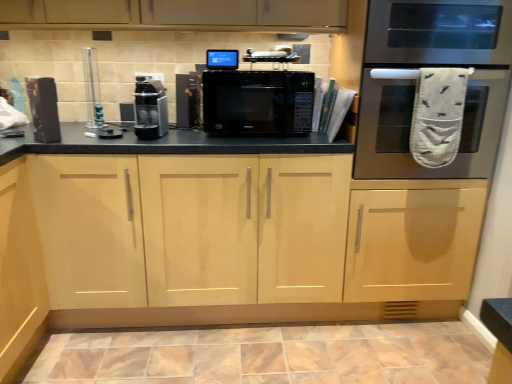
Measure the distance between point (x=412, y=171) and camera.

Result: They are 6.07 feet apart.

Describe the element at coordinates (435, 67) in the screenshot. I see `stainless steel oven at right` at that location.

The height and width of the screenshot is (384, 512). I want to click on light wood cabinet at center, so click(x=263, y=241).

In order to face matte black speaker at left, the fifth appliance when ordered from right to left, should I rotate leftwards or rightwards?

Turn left approximately 26.367 degrees to face it.

Where is `blue glossy monitor at upper center, the first appliance viewed from the right`? Image resolution: width=512 pixels, height=384 pixels. blue glossy monitor at upper center, the first appliance viewed from the right is located at coordinates (222, 59).

Are light wood cabinet at center and marble-like ceramic tile at lower center beside each other?

No, light wood cabinet at center is not in contact with marble-like ceramic tile at lower center.

From the image's perspective, is light wood cabinet at center over marble-like ceramic tile at lower center?

Correct, light wood cabinet at center appears higher than marble-like ceramic tile at lower center in the image.

Could you tell me if light wood cabinet at center is turned towards marble-like ceramic tile at lower center?

Yes, light wood cabinet at center is oriented towards marble-like ceramic tile at lower center.

How far apart are clear glass vase at upper left, which is the second appliance from left to right, and blue glossy monitor at upper center, the first appliance viewed from the right?

They are 24.46 inches apart.

Does clear glass vase at upper left, which is the second appliance from left to right, have a greater height compared to blue glossy monitor at upper center, positioned as the 5th appliance in left-to-right order?

Correct, clear glass vase at upper left, which is the second appliance from left to right, is much taller as blue glossy monitor at upper center, positioned as the 5th appliance in left-to-right order.

Starting from the blue glossy monitor at upper center, positioned as the 5th appliance in left-to-right order, which appliance is the 3rd one to the left? Please provide its 2D coordinates.

[(92, 88)]

From a real-world perspective, is clear glass vase at upper left, which is the second appliance from left to right, positioned above or below blue glossy monitor at upper center, the first appliance viewed from the right?

clear glass vase at upper left, which is the second appliance from left to right, is below blue glossy monitor at upper center, the first appliance viewed from the right.

From a real-world perspective, which object stands above the other?

blue glossy monitor at upper center, the first appliance viewed from the right, from a real-world perspective.

Measure the distance between light wood cabinet at center and blue glossy monitor at upper center, the first appliance viewed from the right.

They are 39.04 inches apart.

Consider the image. Is light wood cabinet at center facing away from blue glossy monitor at upper center, the first appliance viewed from the right?

No, light wood cabinet at center is not facing the opposite direction of blue glossy monitor at upper center, the first appliance viewed from the right.

Between light wood cabinet at center and blue glossy monitor at upper center, positioned as the 5th appliance in left-to-right order, which one appears on the right side from the viewer's perspective?

A: blue glossy monitor at upper center, positioned as the 5th appliance in left-to-right order, is more to the right.

Looking at this image, from their relative heights in the image, would you say stainless steel oven at right is taller or shorter than black matte microwave at center, the second appliance in the right-to-left sequence?

Clearly, stainless steel oven at right is taller compared to black matte microwave at center, the second appliance in the right-to-left sequence.

Is stainless steel oven at right thinner than black matte microwave at center, which is the fourth appliance from left to right?

No.

Which of these two, stainless steel oven at right or black matte microwave at center, which is the fourth appliance from left to right, is bigger?

stainless steel oven at right.

From the image's perspective, is stainless steel oven at right above or below black matte microwave at center, which is the fourth appliance from left to right?

Based on their image positions, stainless steel oven at right is located above black matte microwave at center, which is the fourth appliance from left to right.

The height and width of the screenshot is (384, 512). What are the coordinates of `microwave oven behind the light wood cabinet at center` in the screenshot? It's located at (258, 102).

Measure the distance from black matte microwave at center to light wood cabinet at center.

black matte microwave at center is 17.03 inches away from light wood cabinet at center.

From a real-world perspective, is black matte microwave at center positioned over light wood cabinet at center based on gravity?

Yes, from a real-world perspective, black matte microwave at center is over light wood cabinet at center

From the image's perspective, which one is positioned lower, black matte microwave at center or light wood cabinet at center?

light wood cabinet at center.

Is clear glass vase at upper left, which is the second appliance from left to right, oriented towards stainless steel oven at right?

No, clear glass vase at upper left, which is the second appliance from left to right, is not aimed at stainless steel oven at right.

Are clear glass vase at upper left, which ranks as the 4th appliance in right-to-left order, and stainless steel oven at right beside each other?

clear glass vase at upper left, which ranks as the 4th appliance in right-to-left order, is not next to stainless steel oven at right, and they're not touching.

Does clear glass vase at upper left, which is the second appliance from left to right, come behind stainless steel oven at right?

Yes, the depth of clear glass vase at upper left, which is the second appliance from left to right, is greater than that of stainless steel oven at right.

Is matte black speaker at left, the fifth appliance when ordered from right to left, oriented towards light wood cabinet at center?

No, matte black speaker at left, the fifth appliance when ordered from right to left, is not facing towards light wood cabinet at center.

From the image's perspective, is matte black speaker at left, the fifth appliance when ordered from right to left, on top of light wood cabinet at center?

Yes, from the image's perspective, matte black speaker at left, the fifth appliance when ordered from right to left, is over light wood cabinet at center.

How distant is matte black speaker at left, arranged as the 1th appliance when viewed from the left, from light wood cabinet at center?

A distance of 34.57 inches exists between matte black speaker at left, arranged as the 1th appliance when viewed from the left, and light wood cabinet at center.

I want to click on cabinetry directly beneath the matte black speaker at left, the fifth appliance when ordered from right to left (from a real-world perspective), so click(x=263, y=241).

Where is `ceramic tile on the right of light wood cabinet at center`? This screenshot has height=384, width=512. ceramic tile on the right of light wood cabinet at center is located at coordinates (x=267, y=355).

Which appliance is the 1st one when counting from the front of the clear glass vase at upper left, which is the second appliance from left to right? Please provide its 2D coordinates.

[(222, 59)]

Estimate the real-world distances between objects in this image. Which object is closer to blue glossy monitor at upper center, the first appliance viewed from the right, marble-like ceramic tile at lower center or clear glass vase at upper left, which ranks as the 4th appliance in right-to-left order?

clear glass vase at upper left, which ranks as the 4th appliance in right-to-left order, is positioned closer to the anchor blue glossy monitor at upper center, the first appliance viewed from the right.

When comparing their distances from marble-like ceramic tile at lower center, does black matte microwave at center or clear glass vase at upper left, which ranks as the 4th appliance in right-to-left order, seem further?

clear glass vase at upper left, which ranks as the 4th appliance in right-to-left order.

Considering their positions, is clear glass vase at upper left, which ranks as the 4th appliance in right-to-left order, positioned closer to matte black speaker at left, arranged as the 1th appliance when viewed from the left, than light wood cabinet at center?

clear glass vase at upper left, which ranks as the 4th appliance in right-to-left order, is positioned closer to the anchor matte black speaker at left, arranged as the 1th appliance when viewed from the left.

Looking at the image, which one is located further to stainless steel oven at right, light wood cabinet at center or satin black coffee machine at center, the third appliance from the right?

Among the two, satin black coffee machine at center, the third appliance from the right, is located further to stainless steel oven at right.

Which object lies further to the anchor point light wood cabinet at center, stainless steel oven at right or satin black coffee machine at center, the third appliance from the right?

satin black coffee machine at center, the third appliance from the right, is further to light wood cabinet at center.

Estimate the real-world distances between objects in this image. Which object is closer to satin black coffee machine at center, which appears as the third appliance when viewed from the left, black matte microwave at center, the second appliance in the right-to-left sequence, or black matte microwave at center?

Among the two, black matte microwave at center, the second appliance in the right-to-left sequence, is located nearer to satin black coffee machine at center, which appears as the third appliance when viewed from the left.

From the image, which object appears to be farther from black matte microwave at center, light wood cabinet at center or satin black coffee machine at center, the third appliance from the right?

light wood cabinet at center lies further to black matte microwave at center than the other object.

Looking at the image, which one is located further to black matte microwave at center, satin black coffee machine at center, the third appliance from the right, or black matte microwave at center, the second appliance in the right-to-left sequence?

satin black coffee machine at center, the third appliance from the right, is positioned further to the anchor black matte microwave at center.

The image size is (512, 384). Find the location of `appliance between black matte microwave at center, the second appliance in the right-to-left sequence, and stainless steel oven at right, in the horizontal direction`. appliance between black matte microwave at center, the second appliance in the right-to-left sequence, and stainless steel oven at right, in the horizontal direction is located at coordinates (222, 59).

Where is `microwave oven located between satin black coffee machine at center, the third appliance from the right, and stainless steel oven at right in the left-right direction`? microwave oven located between satin black coffee machine at center, the third appliance from the right, and stainless steel oven at right in the left-right direction is located at coordinates (258, 102).

The height and width of the screenshot is (384, 512). I want to click on microwave oven between clear glass vase at upper left, which ranks as the 4th appliance in right-to-left order, and stainless steel oven at right, in the horizontal direction, so (258, 102).

You are a GUI agent. You are given a task and a screenshot of the screen. Output one action in this format:
    pyautogui.click(x=<x>, y=<y>)
    Task: Click on the oven between blue glossy monitor at upper center, positioned as the 5th appliance in left-to-right order, and marble-like ceramic tile at lower center vertically
    Image resolution: width=512 pixels, height=384 pixels.
    Given the screenshot: What is the action you would take?
    pyautogui.click(x=435, y=67)